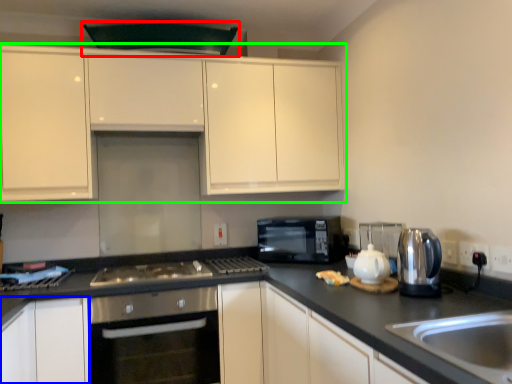
Question: Estimate the real-world distances between objects in this image. Which object is farther from exhaust hood (highlighted by a red box), cabinetry (highlighted by a blue box) or cabinetry (highlighted by a green box)?

Choices:
 (A) cabinetry
 (B) cabinetry

Answer: (A)